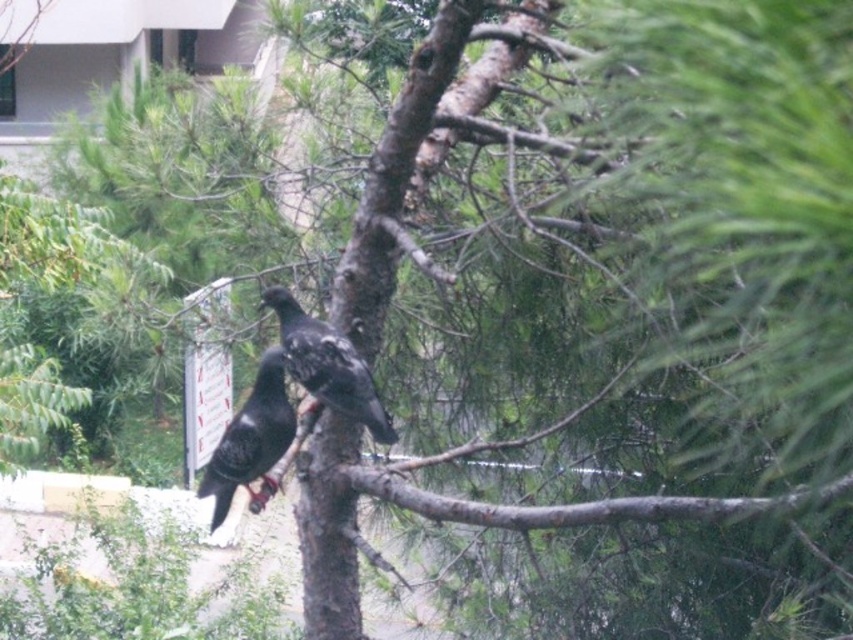
Can you confirm if brown rough tree branch at center is positioned to the right of shiny black pigeon at center?

Indeed, brown rough tree branch at center is positioned on the right side of shiny black pigeon at center.

Can you confirm if brown rough tree branch at center is positioned below shiny black pigeon at center?

Correct, brown rough tree branch at center is located below shiny black pigeon at center.

Is point (410, 496) closer to camera compared to point (213, 524)?

Yes, point (410, 496) is closer to viewer.

Where is `brown rough tree branch at center`? This screenshot has width=853, height=640. brown rough tree branch at center is located at coordinates (573, 502).

Who is shorter, shiny black pigeon at center or shiny black bird at center?

With less height is shiny black bird at center.

Identify the location of shiny black pigeon at center. This screenshot has height=640, width=853. pos(251,442).

This screenshot has height=640, width=853. What are the coordinates of `shiny black pigeon at center` in the screenshot? It's located at (251, 442).

Which is behind, point (770, 502) or point (370, 387)?

The point (370, 387) is more distant.

Can you confirm if brown rough tree branch at center is shorter than shiny black bird at center?

Yes, brown rough tree branch at center is shorter than shiny black bird at center.

Is point (721, 509) positioned before point (300, 358)?

That is True.

Locate an element on the screen. brown rough tree branch at center is located at coordinates (573, 502).